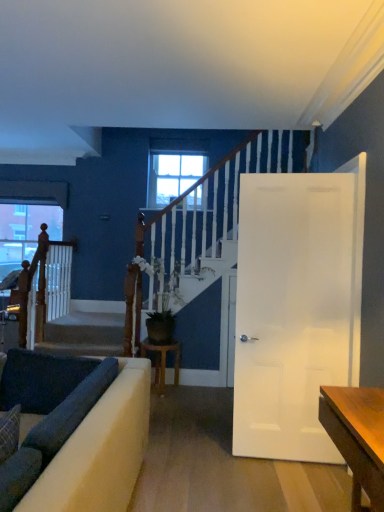
In the scene shown: In order to face green leafy plant at center, should I rotate leftwards or rightwards?

It's best to rotate left around 4.025 degrees.

This screenshot has width=384, height=512. I want to click on green leafy plant at center, so (x=161, y=323).

Where is `transparent glass window at upper left, which appears as the second window when viewed from the top`? transparent glass window at upper left, which appears as the second window when viewed from the top is located at coordinates (25, 232).

In order to face wooden stool at center, should I rotate leftwards or rightwards?

You should rotate left by 4.329 degrees.

The image size is (384, 512). I want to click on wooden stool at center, so click(162, 361).

This screenshot has width=384, height=512. What do you see at coordinates (85, 334) in the screenshot?
I see `smooth concrete stairs at center` at bounding box center [85, 334].

What do you see at coordinates (295, 309) in the screenshot?
I see `white glossy door at right` at bounding box center [295, 309].

What do you see at coordinates (173, 175) in the screenshot?
I see `clear glass window at center, arranged as the first window when viewed from the right` at bounding box center [173, 175].

At what (x,y) coordinates should I click in order to perform the action: click on dark fabric cushion at lower left. Please return your answer as a coordinate pair (x, y). Image resolution: width=384 pixels, height=512 pixels. Looking at the image, I should click on (40, 380).

The width and height of the screenshot is (384, 512). What do you see at coordinates (74, 432) in the screenshot?
I see `velvet dark blue sofa at lower left` at bounding box center [74, 432].

The width and height of the screenshot is (384, 512). Find the location of `green leafy plant at center`. green leafy plant at center is located at coordinates (161, 323).

Is smooth concrete stairs at center surrounded by white glossy door at right?

Definitely not — smooth concrete stairs at center is not inside white glossy door at right.

Which is more distant, (255, 297) or (47, 348)?

Positioned behind is point (47, 348).

Which object is thinner, white glossy door at right or smooth concrete stairs at center?

white glossy door at right.

Is white glossy door at right looking in the opposite direction of smooth concrete stairs at center?

Result: white glossy door at right is not turned away from smooth concrete stairs at center.

Between white glossy door at right and clear glass window at center, positioned as the 2th window in left-to-right order, which one is positioned behind?

Positioned behind is clear glass window at center, positioned as the 2th window in left-to-right order.

From a real-world perspective, is white glossy door at right physically located above or below clear glass window at center, acting as the second window starting from the bottom?

Clearly, from a real-world perspective, white glossy door at right is below clear glass window at center, acting as the second window starting from the bottom.

From the image's perspective, is white glossy door at right above clear glass window at center, positioned as the 2th window in left-to-right order?

No, from the image's perspective, white glossy door at right is not over clear glass window at center, positioned as the 2th window in left-to-right order.

From the image's perspective, does green leafy plant at center appear lower than velvet dark blue sofa at lower left?

No, from the image's perspective, green leafy plant at center is not beneath velvet dark blue sofa at lower left.

Does point (158, 318) appear closer or farther from the camera than point (115, 416)?

Clearly, point (158, 318) is more distant from the camera than point (115, 416).

Based on the photo, from a real-world perspective, which object rests below the other?

velvet dark blue sofa at lower left is physically lower.

Where is `dark that is above the velvet dark blue sofa at lower left (from a real-world perspective)`? The image size is (384, 512). dark that is above the velvet dark blue sofa at lower left (from a real-world perspective) is located at coordinates (40, 380).

Is point (49, 393) more distant than point (115, 440)?

That is True.

Is dark fabric cushion at lower left facing away from velvet dark blue sofa at lower left?

No.

Considering the sizes of dark fabric cushion at lower left and smooth concrete stairs at center in the image, is dark fabric cushion at lower left bigger or smaller than smooth concrete stairs at center?

In the image, dark fabric cushion at lower left appears to be smaller than smooth concrete stairs at center.

Measure the distance between dark fabric cushion at lower left and smooth concrete stairs at center.

They are 5.44 feet apart.

In the scene shown: Is the surface of dark fabric cushion at lower left in direct contact with smooth concrete stairs at center?

There is a gap between dark fabric cushion at lower left and smooth concrete stairs at center.

Is dark fabric cushion at lower left positioned in front of smooth concrete stairs at center?

Yes, it is in front of smooth concrete stairs at center.

Is dark fabric cushion at lower left turned away from wooden stool at center?

Correct, dark fabric cushion at lower left is looking away from wooden stool at center.

Can you confirm if dark fabric cushion at lower left is wider than wooden stool at center?

No.

Can you tell me how much dark fabric cushion at lower left and wooden stool at center differ in facing direction?

There is a 0.245-degree angle between the facing directions of dark fabric cushion at lower left and wooden stool at center.

Is dark fabric cushion at lower left taller or shorter than wooden stool at center?

In the image, dark fabric cushion at lower left appears to be shorter than wooden stool at center.

From the image's perspective, is transparent glass window at upper left, acting as the second window starting from the front, on white glossy door at right?

Yes, from the image's perspective, transparent glass window at upper left, acting as the second window starting from the front, is on top of white glossy door at right.

Can you tell me how much transparent glass window at upper left, which is the first window in back-to-front order, and white glossy door at right differ in facing direction?

175 degrees.

Is transparent glass window at upper left, the first window from the left, oriented towards white glossy door at right?

No, transparent glass window at upper left, the first window from the left, does not turn towards white glossy door at right.

From a real-world perspective, between transparent glass window at upper left, the first window from the left, and white glossy door at right, who is vertically lower?

In real-world perspective, white glossy door at right is lower.

Identify the location of stairwell behind the white glossy door at right. The width and height of the screenshot is (384, 512). (85, 334).

Where is `door beneath the clear glass window at center, which ranks as the first window in front-to-back order (from a real-world perspective)`? door beneath the clear glass window at center, which ranks as the first window in front-to-back order (from a real-world perspective) is located at coordinates pos(295,309).

Which object lies further to the anchor point green leafy plant at center, wooden stool at center or dark fabric cushion at lower left?

dark fabric cushion at lower left is positioned further to the anchor green leafy plant at center.

From the picture: Looking at the image, which one is located further to dark fabric cushion at lower left, white glossy door at right or smooth concrete stairs at center?

Based on the image, smooth concrete stairs at center appears to be further to dark fabric cushion at lower left.

Which object lies further to the anchor point green leafy plant at center, clear glass window at center, acting as the first window starting from the top, or dark fabric cushion at lower left?

dark fabric cushion at lower left lies further to green leafy plant at center than the other object.

Looking at the image, which one is located closer to transparent glass window at upper left, placed as the second window when sorted from right to left, smooth concrete stairs at center or green leafy plant at center?

Based on the image, smooth concrete stairs at center appears to be nearer to transparent glass window at upper left, placed as the second window when sorted from right to left.

Considering their positions, is wooden stool at center positioned further to transparent glass window at upper left, which is the first window in back-to-front order, than white glossy door at right?

white glossy door at right is further to transparent glass window at upper left, which is the first window in back-to-front order.

Based on their spatial positions, is velvet dark blue sofa at lower left or white glossy door at right closer to wooden stool at center?

The object closer to wooden stool at center is white glossy door at right.

Based on their spatial positions, is clear glass window at center, acting as the second window starting from the bottom, or dark fabric cushion at lower left closer to white glossy door at right?

dark fabric cushion at lower left is positioned closer to the anchor white glossy door at right.

Looking at the image, which one is located further to wooden stool at center, clear glass window at center, positioned as the 2th window in left-to-right order, or smooth concrete stairs at center?

Based on the image, clear glass window at center, positioned as the 2th window in left-to-right order, appears to be further to wooden stool at center.

The image size is (384, 512). Identify the location of table between dark fabric cushion at lower left and transparent glass window at upper left, the 1th window ordered from the bottom, along the z-axis. (162, 361).

The width and height of the screenshot is (384, 512). In order to click on table located between white glossy door at right and transparent glass window at upper left, the first window from the left, in the depth direction in this screenshot , I will do `click(162, 361)`.

I want to click on table between smooth concrete stairs at center and green leafy plant at center in the horizontal direction, so click(x=162, y=361).

Where is `window between dark fabric cushion at lower left and transparent glass window at upper left, which is the first window in back-to-front order, from front to back`? The image size is (384, 512). window between dark fabric cushion at lower left and transparent glass window at upper left, which is the first window in back-to-front order, from front to back is located at coordinates (173, 175).